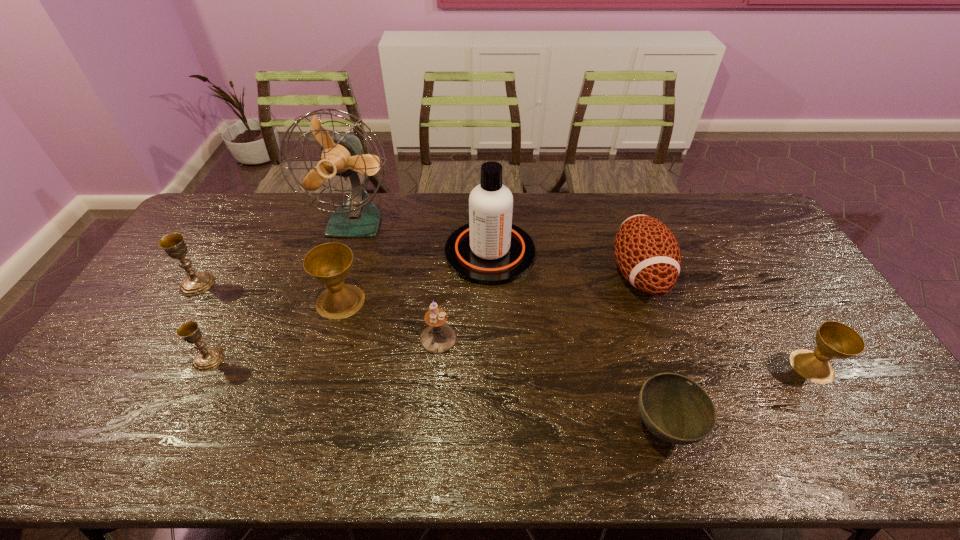
Where is `free spot between the shortest object and the football`? This screenshot has height=540, width=960. free spot between the shortest object and the football is located at coordinates (651, 350).

Identify the location of free spot between the second chalice from right to left and the smaller gold chalice. Image resolution: width=960 pixels, height=540 pixels. (275, 330).

Locate which object is the seventh closest to the football. Please provide its 2D coordinates. Your answer should be formatted as a tuple, i.e. [(x, y)], where the tuple contains the x and y coordinates of a point satisfying the conditions above.

[(208, 359)]

Choose which object is the eighth nearest neighbor to the cleansing agent. Please provide its 2D coordinates. Your answer should be formatted as a tuple, i.e. [(x, y)], where the tuple contains the x and y coordinates of a point satisfying the conditions above.

[(173, 244)]

At what (x,y) coordinates should I click in order to perform the action: click on chalice that is the second closest one to the bigger gold chalice. Please return your answer as a coordinate pair (x, y). Image resolution: width=960 pixels, height=540 pixels. Looking at the image, I should click on (329, 264).

Find the location of a particular element. Image resolution: width=960 pixels, height=540 pixels. the second closest chalice to the smaller brown chalice is located at coordinates (208, 359).

Where is `free spot that satisfies the following two spatial constraints: 1. on the front-facing side of the purple candle holder for air flow; 2. on the right side of the blue fan`? The height and width of the screenshot is (540, 960). free spot that satisfies the following two spatial constraints: 1. on the front-facing side of the purple candle holder for air flow; 2. on the right side of the blue fan is located at coordinates (320, 339).

The width and height of the screenshot is (960, 540). I want to click on vacant space that satisfies the following two spatial constraints: 1. on the back side of the football; 2. on the right side of the shortest object, so click(617, 274).

Locate an element on the screen. vacant space that satisfies the following two spatial constraints: 1. on the front side of the leftmost object; 2. on the left side of the nearer brown chalice is located at coordinates (148, 366).

You are a GUI agent. You are given a task and a screenshot of the screen. Output one action in this format:
    pyautogui.click(x=<x>, y=<y>)
    Task: Click on the free space that satisfies the following two spatial constraints: 1. on the back side of the right gold chalice; 2. on the right side of the candle holder
    Image resolution: width=960 pixels, height=540 pixels.
    Given the screenshot: What is the action you would take?
    pyautogui.click(x=220, y=339)